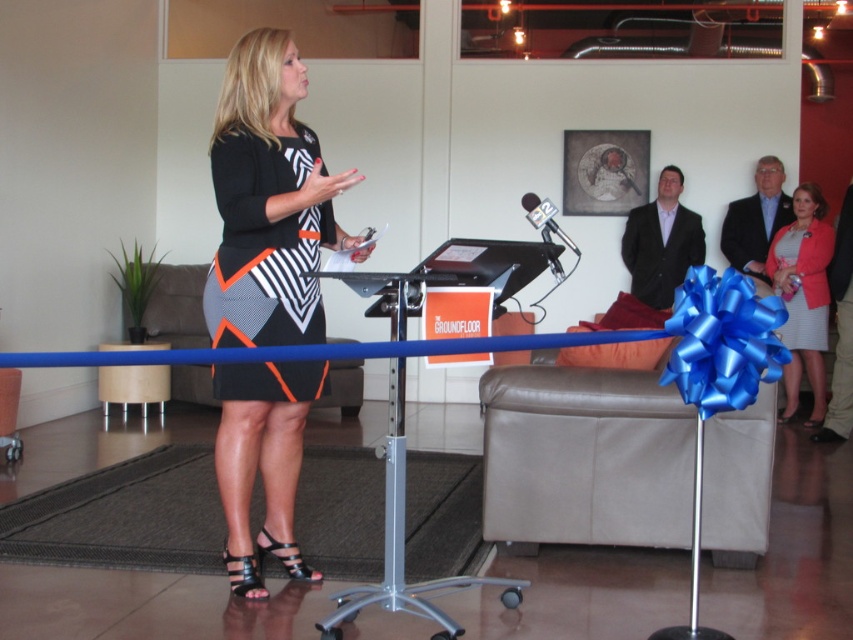
Which is behind, point (257, 364) or point (543, 234)?

Positioned behind is point (257, 364).

Is the position of black matte dress at center less distant than that of black metallic microphone at center?

That is True.

Is point (299, 301) closer to viewer compared to point (535, 198)?

No, (299, 301) is behind (535, 198).

Identify the location of black matte dress at center. (265, 244).

Which is more to the left, matte black dress at right or black metallic microphone at center?

Positioned to the left is black metallic microphone at center.

From the picture: Which is more to the right, matte black dress at right or black metallic microphone at center?

matte black dress at right

In order to click on matte black dress at right in this screenshot , I will do `click(804, 284)`.

Locate an element on the screen. The width and height of the screenshot is (853, 640). matte black dress at right is located at coordinates (804, 284).

Which is more to the right, black and white dress at center or black metallic microphone at center?

Positioned to the right is black metallic microphone at center.

Is black and white dress at center positioned behind black metallic microphone at center?

No, it is in front of black metallic microphone at center.

Find the location of a particular element. Image resolution: width=853 pixels, height=640 pixels. black and white dress at center is located at coordinates (270, 202).

The image size is (853, 640). In order to click on black and white dress at center in this screenshot , I will do `click(270, 202)`.